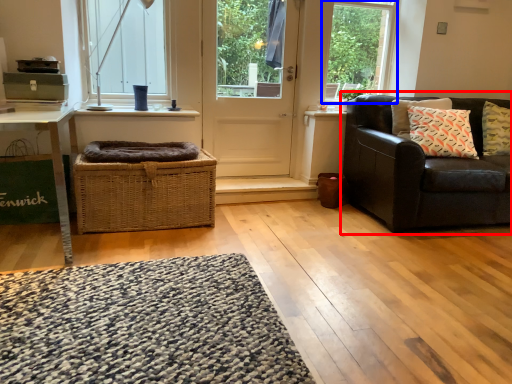
Question: Which object is closer to the camera taking this photo, studio couch (highlighted by a red box) or window frame (highlighted by a blue box)?

Choices:
 (A) studio couch
 (B) window frame

Answer: (A)